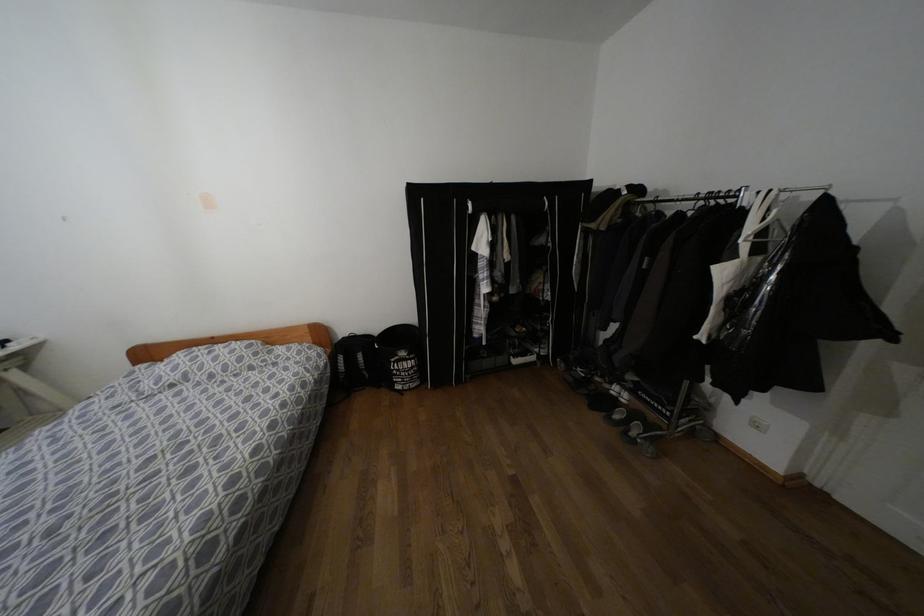
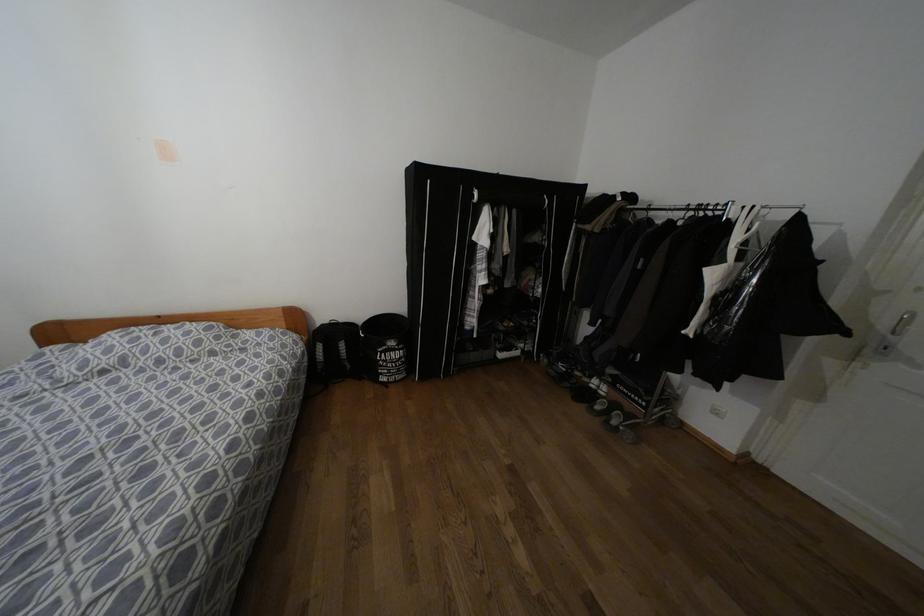
Where in the second image is the point corresponding to [676,200] from the first image?

(669, 209)